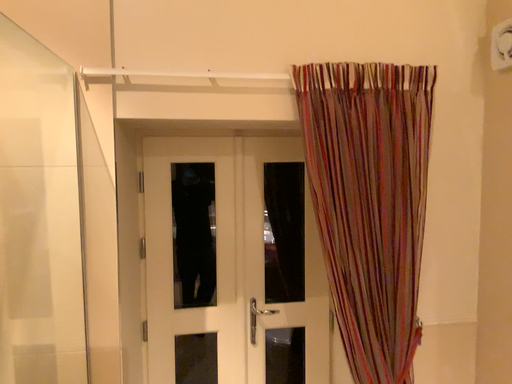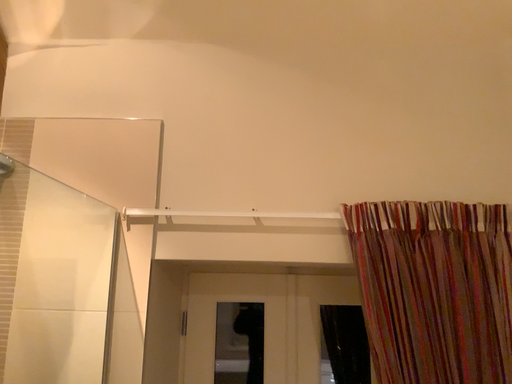
Question: Which way did the camera rotate in the video?

Choices:
 (A) rotated downward
 (B) rotated upward

Answer: (B)